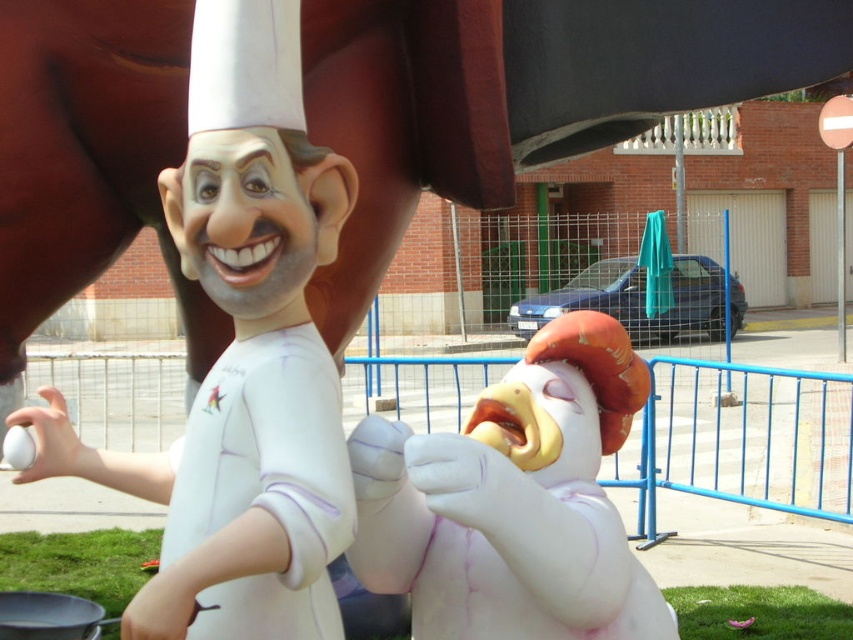
You are a visitor at the sculpture garden and want to take a photo of the chicken sculpture. The camera you have can only focus on objects within a 0.5 unit radius around the point specified. Can you capture the chicken sculpture at point (514, 500)?

The chicken sculpture is located exactly at point (514, 500), so yes, the camera can focus on it since the point is within the 0.5 unit radius.

You are an artist planning to place a new sculpture between the smooth white chicken at center and the white matte chef at center. The new sculpture needs to be larger than the chicken but smaller than the chef. Is this possible based on their sizes?

Yes, since the smooth white chicken at center is smaller than the white matte chef at center, there is a size gap allowing for a new sculpture larger than the chicken but smaller than the chef.

You are standing at the point with coordinates point (314, 179) and want to walk towards the point with coordinates point (376, 547). Will you be moving forward or backward?

Since point (376, 547) is behind point (314, 179), you would be moving backward to reach it.